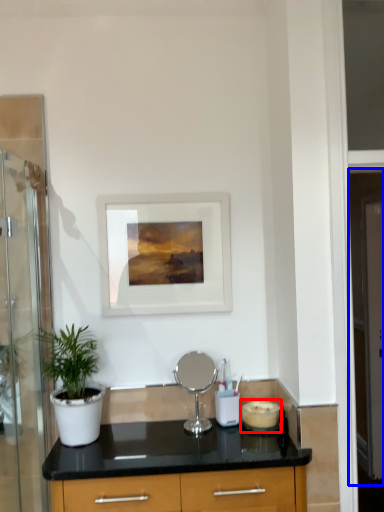
Question: Which object is closer to the camera taking this photo, appliance (highlighted by a red box) or screen door (highlighted by a blue box)?

Choices:
 (A) appliance
 (B) screen door

Answer: (A)